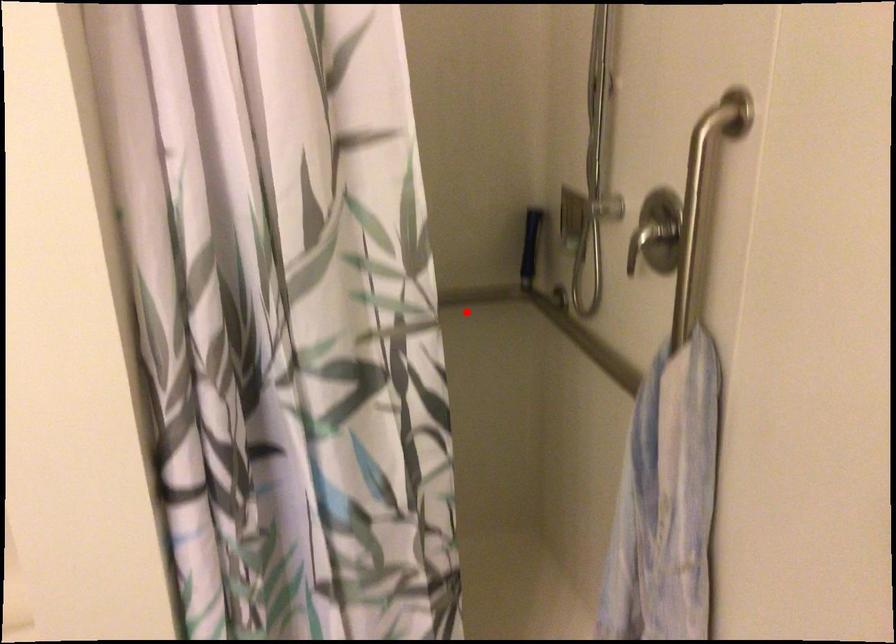
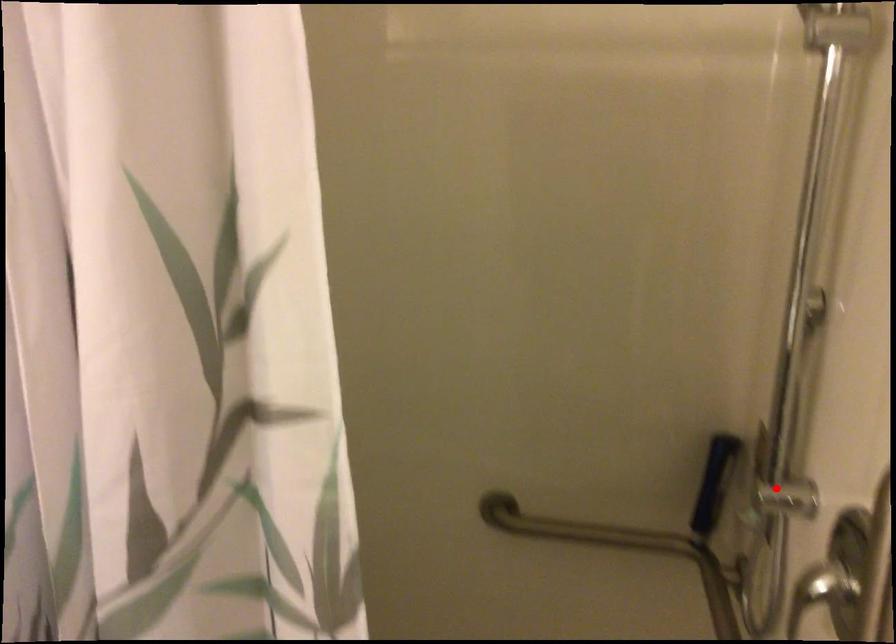
I am providing you with two images of the same scene from different viewpoints. A red point is marked on the first image and another point is marked on the second image. Do the highlighted points in image1 and image2 indicate the same real-world spot?

No